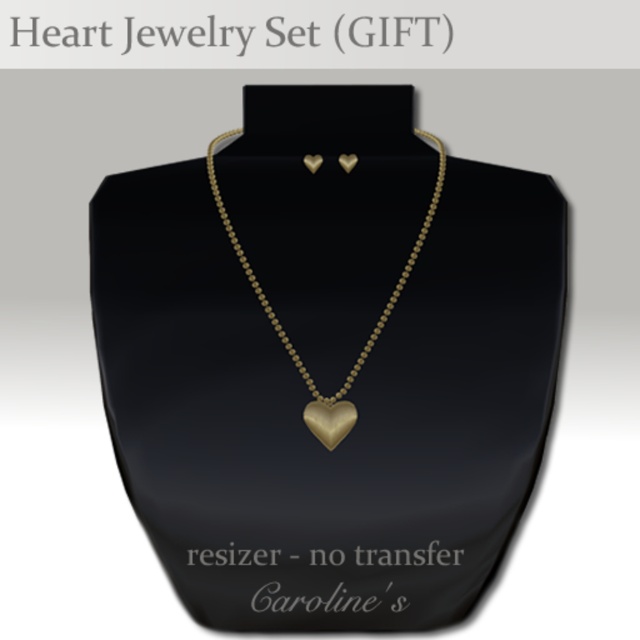
Is gold matte heart-shaped pendant at center in front of gold matte heart at center?

Yes, it is in front of gold matte heart at center.

Which is more to the right, gold matte heart-shaped pendant at center or gold matte heart at center?

gold matte heart at center is more to the right.

Is point (410, 266) positioned before point (324, 422)?

No, it is behind (324, 422).

Identify the location of gold matte heart-shaped pendant at center. The image size is (640, 640). (266, 296).